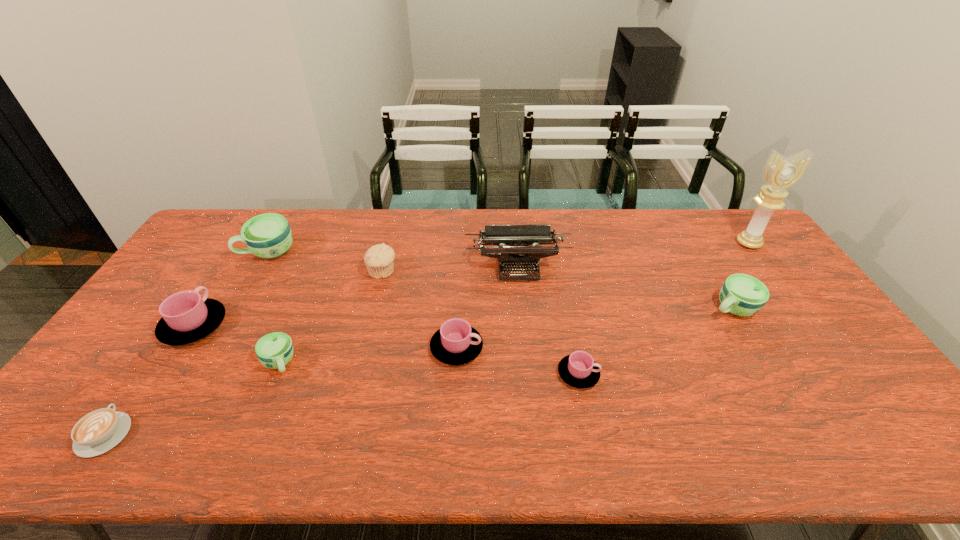
Find the location of a particular element. vacant space at the far edge of the desktop is located at coordinates (581, 225).

The image size is (960, 540). I want to click on vacant area at the near edge of the desktop, so click(x=130, y=430).

Where is `vacant space at the left edge`? The image size is (960, 540). vacant space at the left edge is located at coordinates (192, 286).

This screenshot has width=960, height=540. In the image, there is a desktop. Identify the location of free region at the right edge. (808, 355).

Locate an element on the screen. vacant space at the far left corner of the desktop is located at coordinates (244, 212).

I want to click on vacant area at the far right corner, so click(732, 247).

Identify the location of free region at the near right corner of the desktop. (880, 438).

Locate an element on the screen. Image resolution: width=960 pixels, height=540 pixels. vacant area that lies between the rightmost object and the rightmost pink cup is located at coordinates (663, 308).

Find the location of a particular element. This screenshot has width=960, height=540. free space between the muffin and the award is located at coordinates (565, 258).

Where is `free spot between the smallest pink cup and the cappuccino`? This screenshot has width=960, height=540. free spot between the smallest pink cup and the cappuccino is located at coordinates (342, 404).